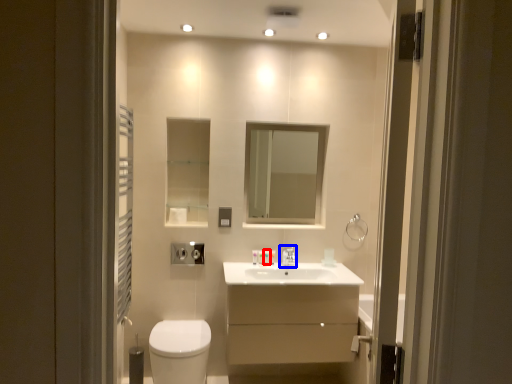
Question: Which of the following is the closest to the observer, toiletry (highlighted by a red box) or tap (highlighted by a blue box)?

Choices:
 (A) toiletry
 (B) tap

Answer: (B)